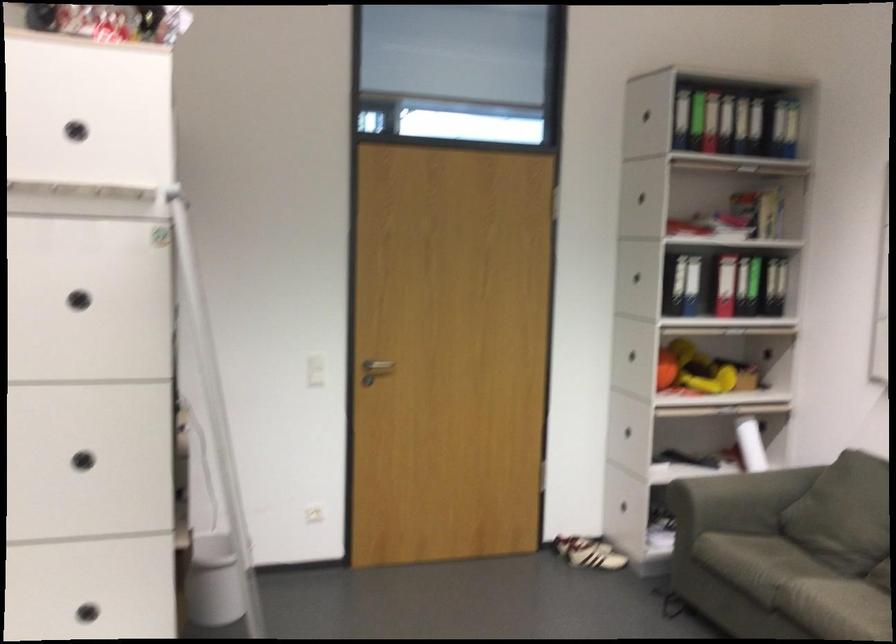
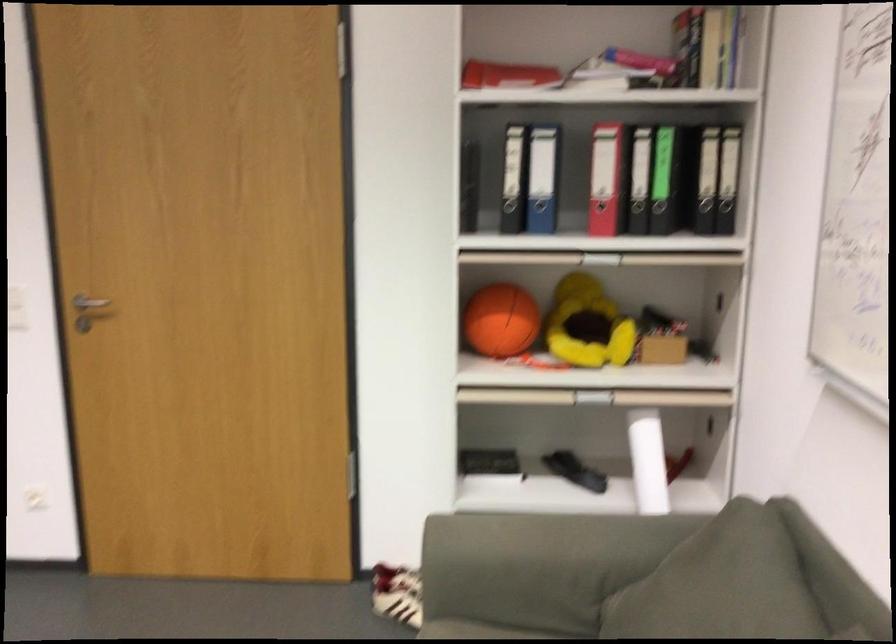
The point at (x=788, y=296) is marked in the first image. Where is the corresponding point in the second image?

(734, 214)